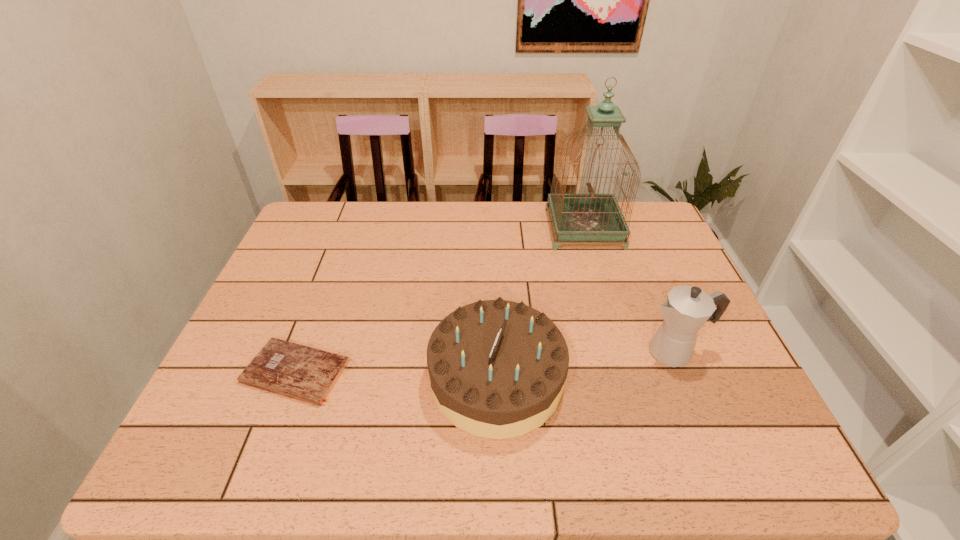
Image resolution: width=960 pixels, height=540 pixels. Identify the location of object at the far right corner. (576, 217).

You are a GUI agent. You are given a task and a screenshot of the screen. Output one action in this format:
    pyautogui.click(x=<x>, y=<y>)
    Task: Click on the vacant space at the far edge
    This screenshot has height=540, width=960.
    Given the screenshot: What is the action you would take?
    pyautogui.click(x=526, y=211)

Locate an element on the screen. The width and height of the screenshot is (960, 540). free space at the near edge of the desktop is located at coordinates (637, 451).

In the image, there is a desktop. Where is `free space at the left edge`? This screenshot has width=960, height=540. free space at the left edge is located at coordinates (292, 259).

Locate an element on the screen. The image size is (960, 540). blank area at the right edge is located at coordinates (687, 270).

Locate an element on the screen. free region at the far left corner of the desktop is located at coordinates (334, 213).

Locate an element on the screen. Image resolution: width=960 pixels, height=540 pixels. free spot between the birdcage and the third shortest object is located at coordinates (629, 291).

The image size is (960, 540). What are the coordinates of `free spot between the third tallest object and the shortest object` in the screenshot? It's located at (396, 375).

Find the location of a particular element. The height and width of the screenshot is (540, 960). unoccupied area between the leftmost object and the birthday cake is located at coordinates click(396, 375).

The width and height of the screenshot is (960, 540). Identify the location of free spot between the coffeepot and the birdcage. (629, 291).